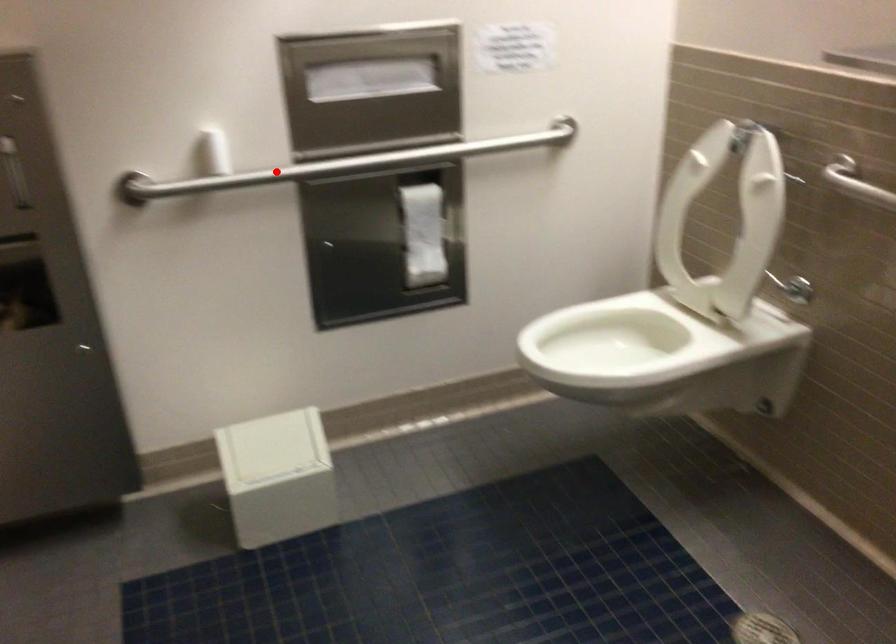
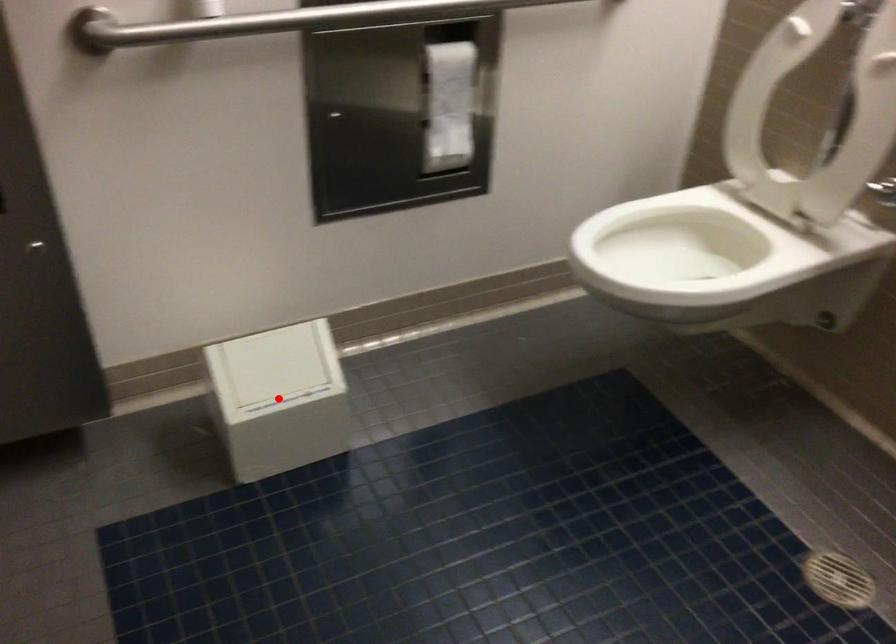
I am providing you with two images of the same scene from different viewpoints. A red point is marked on the first image and another point is marked on the second image. Is the red point in image1 aligned with the point shown in image2?

No